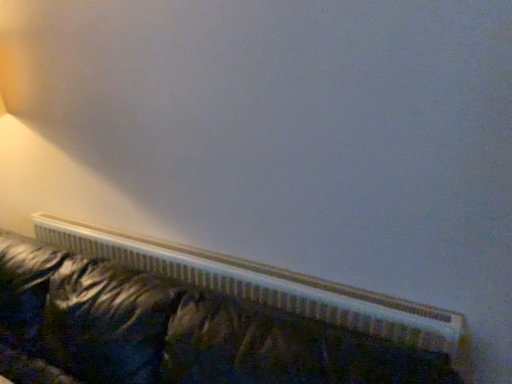
The height and width of the screenshot is (384, 512). What are the coordinates of `white plastic radiator at lower center` in the screenshot? It's located at (173, 331).

Describe the element at coordinates (173, 331) in the screenshot. The height and width of the screenshot is (384, 512). I see `white plastic radiator at lower center` at that location.

The height and width of the screenshot is (384, 512). I want to click on white plastic radiator at lower center, so (x=173, y=331).